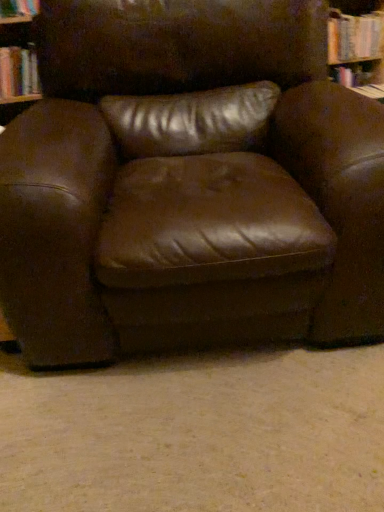
Question: From the image's perspective, is brown leather chair at center above or below hardcover book at upper left?

Choices:
 (A) above
 (B) below

Answer: (B)

Question: Considering the positions of brown leather chair at center and hardcover book at upper left in the image, is brown leather chair at center wider or thinner than hardcover book at upper left?

Choices:
 (A) thin
 (B) wide

Answer: (B)

Question: Choose the correct answer: Is brown leather chair at center inside hardcover book at upper left or outside it?

Choices:
 (A) outside
 (B) inside

Answer: (A)

Question: From a real-world perspective, is hardcover book at upper left physically located above or below brown leather chair at center?

Choices:
 (A) below
 (B) above

Answer: (B)

Question: In terms of size, does hardcover book at upper left appear bigger or smaller than brown leather chair at center?

Choices:
 (A) small
 (B) big

Answer: (A)

Question: Considering the positions of point (13, 61) and point (79, 96), is point (13, 61) closer or farther from the camera than point (79, 96)?

Choices:
 (A) farther
 (B) closer

Answer: (A)

Question: In the image, is hardcover book at upper left positioned in front of or behind brown leather chair at center?

Choices:
 (A) front
 (B) behind

Answer: (B)